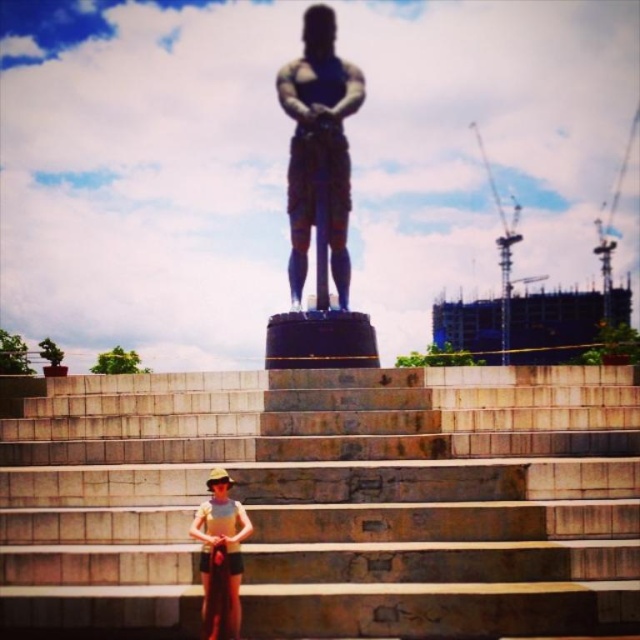
Does brown stone stairs at center lie behind tan fabric shorts at center?

No, brown stone stairs at center is closer to the viewer.

From the picture: Is brown stone stairs at center bigger than tan fabric shorts at center?

Correct, brown stone stairs at center is larger in size than tan fabric shorts at center.

Does point (99, 468) come closer to viewer compared to point (225, 557)?

No, (99, 468) is further to viewer.

Identify the location of brown stone stairs at center. (328, 500).

Is point (458, 412) less distant than point (317, 150)?

Yes, it is in front of point (317, 150).

Which is in front, point (321, 582) or point (316, 36)?

Point (321, 582) is more forward.

Find the location of `brown stone stairs at center`. brown stone stairs at center is located at coordinates (328, 500).

Who is shorter, bronze statue at center or tan fabric shorts at center?

tan fabric shorts at center is shorter.

Is bronze statue at center positioned behind tan fabric shorts at center?

Yes, it is behind tan fabric shorts at center.

The height and width of the screenshot is (640, 640). What do you see at coordinates (317, 147) in the screenshot?
I see `bronze statue at center` at bounding box center [317, 147].

At what (x,y) coordinates should I click in order to perform the action: click on bronze statue at center. Please return your answer as a coordinate pair (x, y). Looking at the image, I should click on (317, 147).